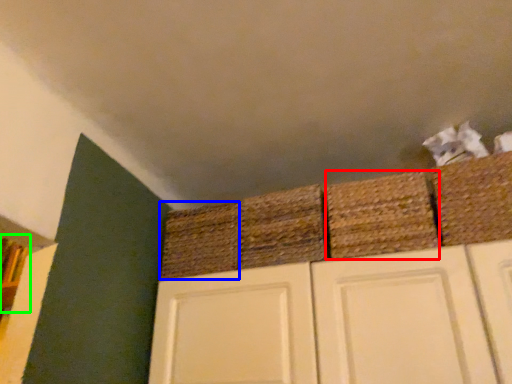
Question: Which object is positioned closest to basket (highlighted by a red box)? Select from basket (highlighted by a blue box) and shelf (highlighted by a green box).

Choices:
 (A) basket
 (B) shelf

Answer: (A)